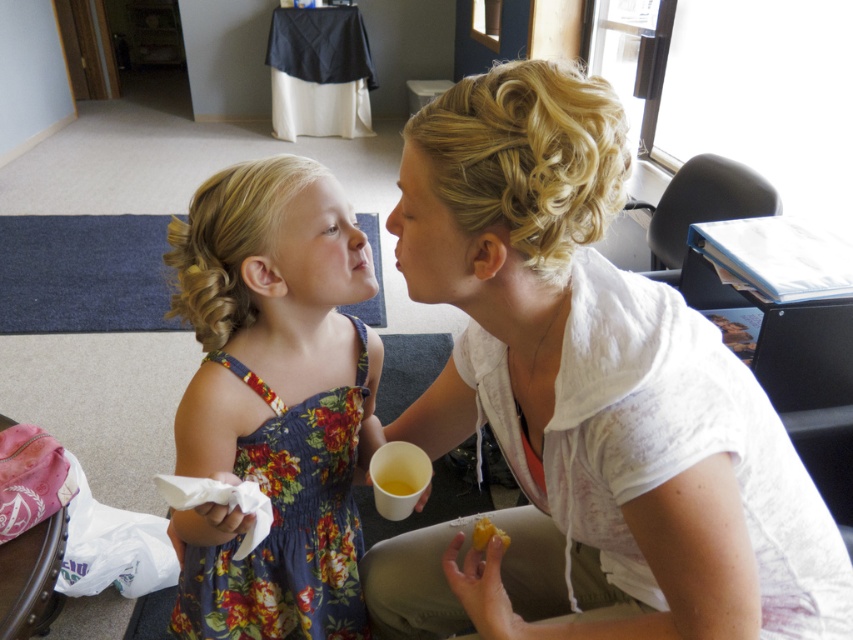
Question: Observing the image, what is the correct spatial positioning of floral fabric dress at center in reference to yellow matte food at lower center?

Choices:
 (A) left
 (B) right

Answer: (A)

Question: Is floral fabric dress at center thinner than yellow matte food at lower center?

Choices:
 (A) yes
 (B) no

Answer: (B)

Question: Which point is farther to the camera?

Choices:
 (A) floral fabric dress at center
 (B) yellow matte food at lower center
 (C) white cotton shirt at upper right

Answer: (B)

Question: Which object is farther from the camera taking this photo?

Choices:
 (A) floral fabric dress at center
 (B) yellow matte food at lower center

Answer: (B)

Question: Does floral fabric dress at center have a greater width compared to yellow matte food at lower center?

Choices:
 (A) yes
 (B) no

Answer: (A)

Question: Which point is farther to the camera?

Choices:
 (A) (314, 496)
 (B) (578, 177)
 (C) (506, 538)

Answer: (A)